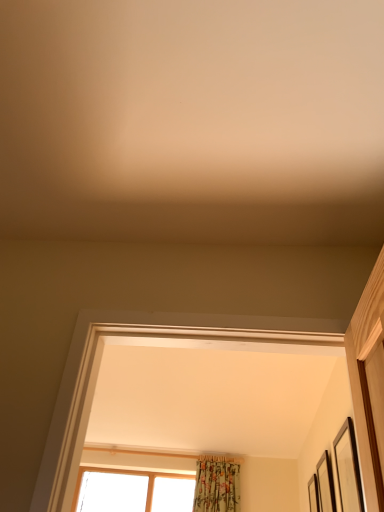
Find the location of a particular element. The image size is (384, 512). wooden picture frame at right, the 3th picture frame viewed from the left is located at coordinates (313, 494).

The image size is (384, 512). What do you see at coordinates (325, 484) in the screenshot?
I see `wooden picture frame at right, the second picture frame positioned from the bottom` at bounding box center [325, 484].

Measure the distance between point (330,493) and camera.

A distance of 7.45 feet exists between point (330,493) and camera.

The height and width of the screenshot is (512, 384). What are the coordinates of `black matte picture frame at right, positioned as the 3th picture frame in bottom-to-top order` in the screenshot? It's located at (348, 469).

At what (x,y) coordinates should I click in order to perform the action: click on wooden picture frame at right, the third picture frame when ordered from front to back. Please return your answer as a coordinate pair (x, y). Image resolution: width=384 pixels, height=512 pixels. Looking at the image, I should click on (313, 494).

Based on the photo, how different are the orientations of wooden picture frame at right, marked as the 2th picture frame in a right-to-left arrangement, and black matte picture frame at right, the first picture frame from the front, in degrees?

There is a 0.0174-degree angle between the facing directions of wooden picture frame at right, marked as the 2th picture frame in a right-to-left arrangement, and black matte picture frame at right, the first picture frame from the front.

Looking at their sizes, would you say wooden picture frame at right, the 2th picture frame when ordered from front to back, is wider or thinner than black matte picture frame at right, the 3th picture frame in the right-to-left sequence?

wooden picture frame at right, the 2th picture frame when ordered from front to back, is wider than black matte picture frame at right, the 3th picture frame in the right-to-left sequence.

Considering the relative sizes of wooden picture frame at right, marked as the 2th picture frame in a right-to-left arrangement, and black matte picture frame at right, the first picture frame from the front, in the image provided, is wooden picture frame at right, marked as the 2th picture frame in a right-to-left arrangement, taller than black matte picture frame at right, the first picture frame from the front,?

No, wooden picture frame at right, marked as the 2th picture frame in a right-to-left arrangement, is not taller than black matte picture frame at right, the first picture frame from the front.

Based on the photo, considering the relative sizes of black matte picture frame at right, the first picture frame when ordered from left to right, and wooden picture frame at right, the second picture frame in the top-to-bottom sequence, in the image provided, is black matte picture frame at right, the first picture frame when ordered from left to right, wider than wooden picture frame at right, the second picture frame in the top-to-bottom sequence,?

A: No, black matte picture frame at right, the first picture frame when ordered from left to right, is not wider than wooden picture frame at right, the second picture frame in the top-to-bottom sequence.

Which point is more distant from viewer, (340, 430) or (331, 476)?

Positioned behind is point (331, 476).

From the picture: Are black matte picture frame at right, positioned as the 3th picture frame in bottom-to-top order, and wooden picture frame at right, acting as the second picture frame starting from the back, located far from each other?

No, there isn't a large distance between black matte picture frame at right, positioned as the 3th picture frame in bottom-to-top order, and wooden picture frame at right, acting as the second picture frame starting from the back.

From their relative heights in the image, would you say black matte picture frame at right, positioned as the 3th picture frame in bottom-to-top order, is taller or shorter than wooden picture frame at right, marked as the 2th picture frame in a right-to-left arrangement?

Considering their sizes, black matte picture frame at right, positioned as the 3th picture frame in bottom-to-top order, has more height than wooden picture frame at right, marked as the 2th picture frame in a right-to-left arrangement.

From the image's perspective, which object appears higher, black matte picture frame at right, which is counted as the third picture frame, starting from the back, or wooden picture frame at right, placed as the 1th picture frame when sorted from bottom to top?

black matte picture frame at right, which is counted as the third picture frame, starting from the back, appears higher in the image.

Is wooden picture frame at right, which ranks as the third picture frame in top-to-bottom order, at the back of black matte picture frame at right, which is counted as the third picture frame, starting from the back?

black matte picture frame at right, which is counted as the third picture frame, starting from the back, does not have its back to wooden picture frame at right, which ranks as the third picture frame in top-to-bottom order.

Would you say black matte picture frame at right, the 3th picture frame in the right-to-left sequence, is outside wooden picture frame at right, which ranks as the third picture frame in top-to-bottom order?

Yes, black matte picture frame at right, the 3th picture frame in the right-to-left sequence, is not within wooden picture frame at right, which ranks as the third picture frame in top-to-bottom order.

From a real-world perspective, is black matte picture frame at right, the first picture frame when ordered from left to right, beneath wooden picture frame at right, which ranks as the third picture frame in top-to-bottom order?

Correct, in the physical world, black matte picture frame at right, the first picture frame when ordered from left to right, is lower than wooden picture frame at right, which ranks as the third picture frame in top-to-bottom order.

Looking at this image, from the image's perspective, is wooden picture frame at right, placed as the first picture frame when sorted from back to front, beneath wooden picture frame at right, the second picture frame in the top-to-bottom sequence?

Yes, from the image's perspective, wooden picture frame at right, placed as the first picture frame when sorted from back to front, is beneath wooden picture frame at right, the second picture frame in the top-to-bottom sequence.

Looking at this image, considering the relative positions of wooden picture frame at right, marked as the first picture frame in a right-to-left arrangement, and wooden picture frame at right, the second picture frame positioned from the bottom, in the image provided, is wooden picture frame at right, marked as the first picture frame in a right-to-left arrangement, to the left of wooden picture frame at right, the second picture frame positioned from the bottom, from the viewer's perspective?

No.

From a real-world perspective, who is located higher, wooden picture frame at right, which ranks as the third picture frame in top-to-bottom order, or wooden picture frame at right, placed as the 2th picture frame when sorted from left to right?

wooden picture frame at right, which ranks as the third picture frame in top-to-bottom order, from a real-world perspective.

Which of these two, wooden picture frame at right, the second picture frame in the top-to-bottom sequence, or wooden picture frame at right, placed as the 1th picture frame when sorted from bottom to top, stands shorter?

wooden picture frame at right, placed as the 1th picture frame when sorted from bottom to top, is shorter.

Where is `picture frame that is on the right side of wooden picture frame at right, placed as the 2th picture frame when sorted from left to right`? This screenshot has height=512, width=384. picture frame that is on the right side of wooden picture frame at right, placed as the 2th picture frame when sorted from left to right is located at coordinates (x=313, y=494).

Between wooden picture frame at right, the second picture frame in the top-to-bottom sequence, and wooden picture frame at right, which ranks as the third picture frame in top-to-bottom order, which one is positioned behind?

wooden picture frame at right, which ranks as the third picture frame in top-to-bottom order.

Can you confirm if wooden picture frame at right, marked as the 2th picture frame in a right-to-left arrangement, is wider than wooden picture frame at right, the third picture frame when ordered from front to back?

No.

Which is closer to the camera, [313,502] or [351,487]?

Point [313,502] is positioned farther from the camera compared to point [351,487].

Is wooden picture frame at right, the 3th picture frame viewed from the left, directly adjacent to black matte picture frame at right, the first picture frame from the front?

There is a gap between wooden picture frame at right, the 3th picture frame viewed from the left, and black matte picture frame at right, the first picture frame from the front.

In the image, is wooden picture frame at right, the third picture frame when ordered from front to back, on the left side or the right side of black matte picture frame at right, which is counted as the third picture frame, starting from the back?

wooden picture frame at right, the third picture frame when ordered from front to back, is to the right of black matte picture frame at right, which is counted as the third picture frame, starting from the back.

Find the location of a particular element. picture frame below the wooden picture frame at right, the 2th picture frame when ordered from front to back (from a real-world perspective) is located at coordinates (348, 469).

Find the location of `the 1st picture frame positioned below the black matte picture frame at right, the first picture frame from the front (from the image's perspective)`. the 1st picture frame positioned below the black matte picture frame at right, the first picture frame from the front (from the image's perspective) is located at coordinates (325, 484).

Based on their spatial positions, is black matte picture frame at right, which is counted as the third picture frame, starting from the back, or wooden picture frame at right, placed as the first picture frame when sorted from back to front, further from wooden picture frame at right, marked as the 2th picture frame in a right-to-left arrangement?

Based on the image, black matte picture frame at right, which is counted as the third picture frame, starting from the back, appears to be further to wooden picture frame at right, marked as the 2th picture frame in a right-to-left arrangement.

Which object lies further to the anchor point wooden picture frame at right, which ranks as the third picture frame in top-to-bottom order, black matte picture frame at right, positioned as the 3th picture frame in bottom-to-top order, or wooden picture frame at right, the second picture frame positioned from the bottom?

The object further to wooden picture frame at right, which ranks as the third picture frame in top-to-bottom order, is black matte picture frame at right, positioned as the 3th picture frame in bottom-to-top order.

Which object lies further to the anchor point wooden picture frame at right, placed as the first picture frame when sorted from back to front, wooden picture frame at right, the 2th picture frame when ordered from front to back, or black matte picture frame at right, which is counted as the third picture frame, starting from the back?

Based on the image, black matte picture frame at right, which is counted as the third picture frame, starting from the back, appears to be further to wooden picture frame at right, placed as the first picture frame when sorted from back to front.

Estimate the real-world distances between objects in this image. Which object is closer to black matte picture frame at right, the 3th picture frame in the right-to-left sequence, wooden picture frame at right, the second picture frame in the top-to-bottom sequence, or wooden picture frame at right, marked as the first picture frame in a right-to-left arrangement?

The object closer to black matte picture frame at right, the 3th picture frame in the right-to-left sequence, is wooden picture frame at right, the second picture frame in the top-to-bottom sequence.

From the image, which object appears to be farther from wooden picture frame at right, the second picture frame in the top-to-bottom sequence, wooden picture frame at right, the 3th picture frame viewed from the left, or black matte picture frame at right, which appears as the first picture frame when viewed from the top?

black matte picture frame at right, which appears as the first picture frame when viewed from the top, is positioned further to the anchor wooden picture frame at right, the second picture frame in the top-to-bottom sequence.

From the picture: Considering their positions, is wooden picture frame at right, the third picture frame when ordered from front to back, positioned closer to black matte picture frame at right, the first picture frame when ordered from left to right, than wooden picture frame at right, the second picture frame positioned from the bottom?

wooden picture frame at right, the second picture frame positioned from the bottom, lies closer to black matte picture frame at right, the first picture frame when ordered from left to right, than the other object.

Where is `picture frame positioned between black matte picture frame at right, which appears as the first picture frame when viewed from the top, and wooden picture frame at right, placed as the first picture frame when sorted from back to front, from near to far`? The height and width of the screenshot is (512, 384). picture frame positioned between black matte picture frame at right, which appears as the first picture frame when viewed from the top, and wooden picture frame at right, placed as the first picture frame when sorted from back to front, from near to far is located at coordinates (325, 484).